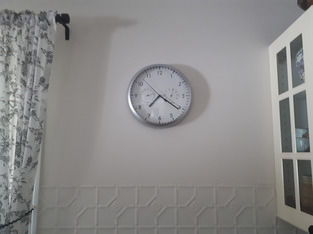
At what (x,y) coordinates should I click in order to perform the action: click on vase. Please return your answer as a coordinate pair (x, y). Image resolution: width=313 pixels, height=234 pixels. Looking at the image, I should click on (301, 65).